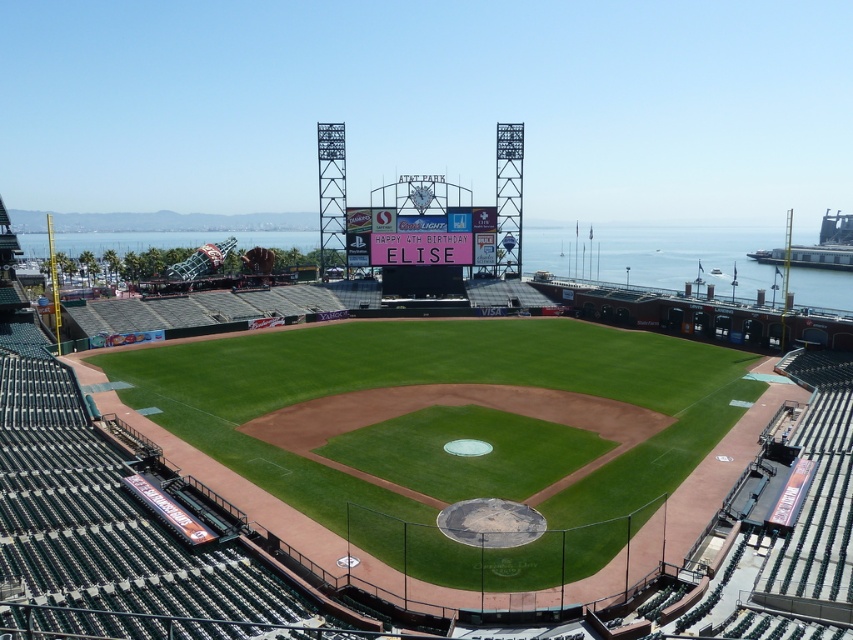
Does transparent glass water at center appear on the left side of pink fabric sign at center?

In fact, transparent glass water at center is to the right of pink fabric sign at center.

Is point (570, 243) behind point (439, 259)?

Yes, point (570, 243) is behind point (439, 259).

Identify the location of transparent glass water at center. (683, 256).

Where is `transparent glass water at center`? transparent glass water at center is located at coordinates (683, 256).

How far apart are green grass baseball stadium at center and pink fabric sign at center?

The distance of green grass baseball stadium at center from pink fabric sign at center is 150.06 feet.

Does green grass baseball stadium at center have a larger size compared to pink fabric sign at center?

Indeed, green grass baseball stadium at center has a larger size compared to pink fabric sign at center.

Is point (331, 385) behind point (349, 244)?

No, (331, 385) is in front of (349, 244).

You are a GUI agent. You are given a task and a screenshot of the screen. Output one action in this format:
    pyautogui.click(x=<x>, y=<y>)
    Task: Click on the green grass baseball stadium at center
    
    Given the screenshot: What is the action you would take?
    pyautogui.click(x=105, y=525)

Who is lower down, green grass baseball stadium at center or transparent glass water at center?

green grass baseball stadium at center is lower down.

Does green grass baseball stadium at center have a lesser height compared to transparent glass water at center?

Yes.

Where is `green grass baseball stadium at center`? green grass baseball stadium at center is located at coordinates (105, 525).

At what (x,y) coordinates should I click in order to perform the action: click on green grass baseball stadium at center. Please return your answer as a coordinate pair (x, y). This screenshot has height=640, width=853. Looking at the image, I should click on (105, 525).